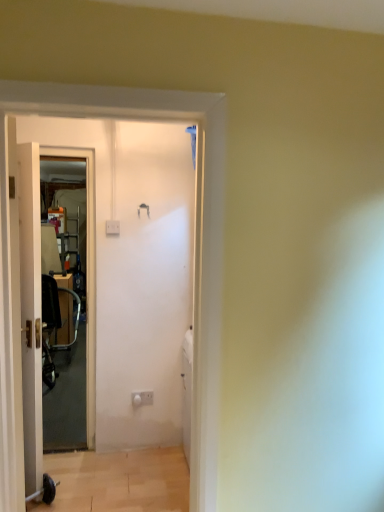
Question: From the image's perspective, is metallic silver baby carriage at left located beneath white plastic electric outlet at center?

Choices:
 (A) no
 (B) yes

Answer: (A)

Question: Can you see metallic silver baby carriage at left touching white plastic electric outlet at center?

Choices:
 (A) yes
 (B) no

Answer: (B)

Question: Would you say metallic silver baby carriage at left is outside white plastic electric outlet at center?

Choices:
 (A) yes
 (B) no

Answer: (A)

Question: Is white plastic electric outlet at center located within metallic silver baby carriage at left?

Choices:
 (A) yes
 (B) no

Answer: (B)

Question: Does metallic silver baby carriage at left have a greater width compared to white plastic electric outlet at center?

Choices:
 (A) no
 (B) yes

Answer: (B)

Question: Considering the relative sizes of metallic silver baby carriage at left and white plastic electric outlet at center in the image provided, is metallic silver baby carriage at left smaller than white plastic electric outlet at center?

Choices:
 (A) yes
 (B) no

Answer: (B)

Question: Does wooden frame screen door at left have a larger size compared to white wooden door at left?

Choices:
 (A) no
 (B) yes

Answer: (A)

Question: From the image's perspective, is wooden frame screen door at left located beneath white wooden door at left?

Choices:
 (A) yes
 (B) no

Answer: (B)

Question: Is wooden frame screen door at left placed right next to white wooden door at left?

Choices:
 (A) no
 (B) yes

Answer: (A)

Question: Could white wooden door at left be considered to be inside wooden frame screen door at left?

Choices:
 (A) yes
 (B) no

Answer: (B)

Question: Is wooden frame screen door at left positioned before white wooden door at left?

Choices:
 (A) no
 (B) yes

Answer: (A)

Question: Does wooden frame screen door at left appear on the right side of white wooden door at left?

Choices:
 (A) no
 (B) yes

Answer: (B)

Question: Are wooden frame screen door at left and metallic silver baby carriage at left beside each other?

Choices:
 (A) yes
 (B) no

Answer: (B)